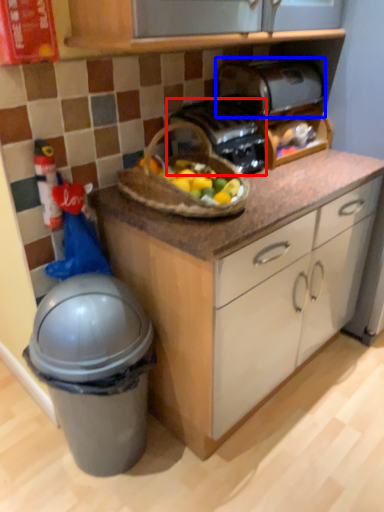
Question: Which object appears farthest to the camera in this image, toaster (highlighted by a red box) or toaster (highlighted by a blue box)?

Choices:
 (A) toaster
 (B) toaster

Answer: (B)